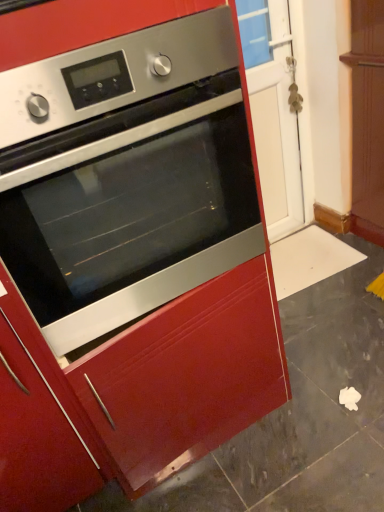
Question: Is glossy wood drawer at center spatially inside transparent glass door at center, or outside of it?

Choices:
 (A) outside
 (B) inside

Answer: (A)

Question: In terms of size, does glossy wood drawer at center appear bigger or smaller than transparent glass door at center?

Choices:
 (A) big
 (B) small

Answer: (A)

Question: Which object is positioned farthest from the transparent glass door at center?

Choices:
 (A) glossy wood drawer at center
 (B) stainless steel oven at center

Answer: (A)

Question: Which object is positioned farthest from the glossy wood drawer at center?

Choices:
 (A) transparent glass door at center
 (B) stainless steel oven at center

Answer: (A)